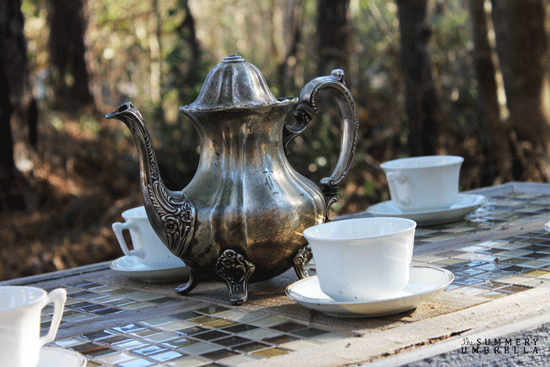
Where is `table`? table is located at coordinates (197, 336).